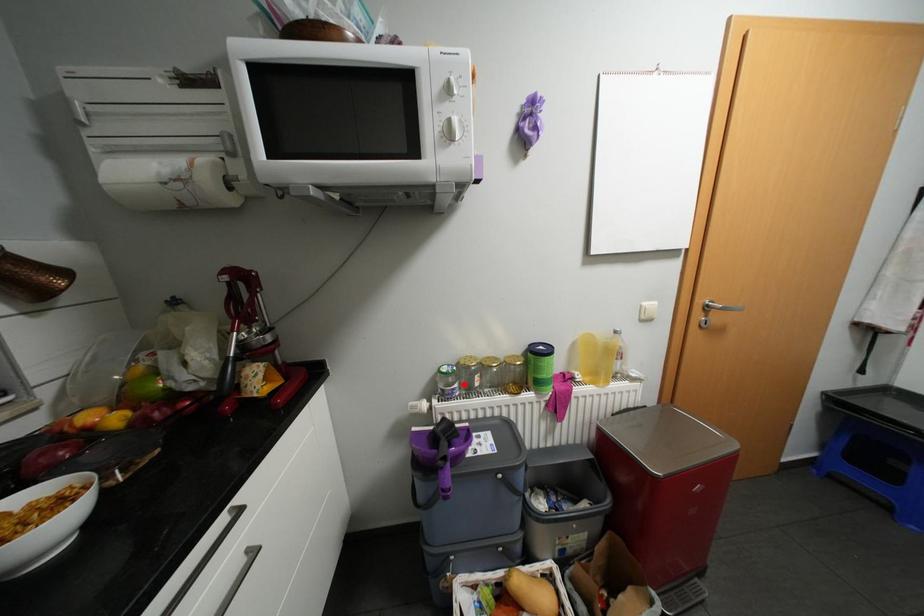
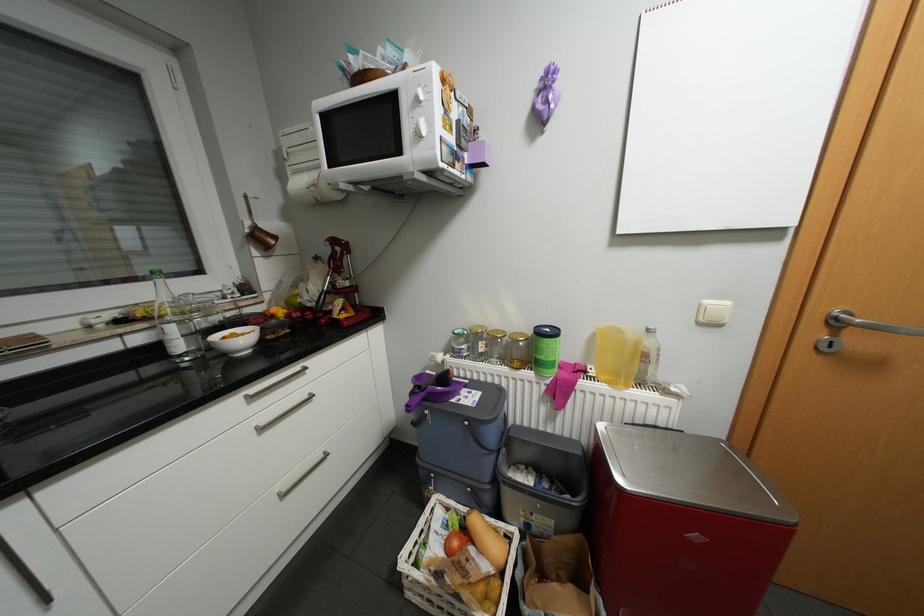
In the second image, find the point that corresponds to the highlighted location in the first image.

(471, 345)